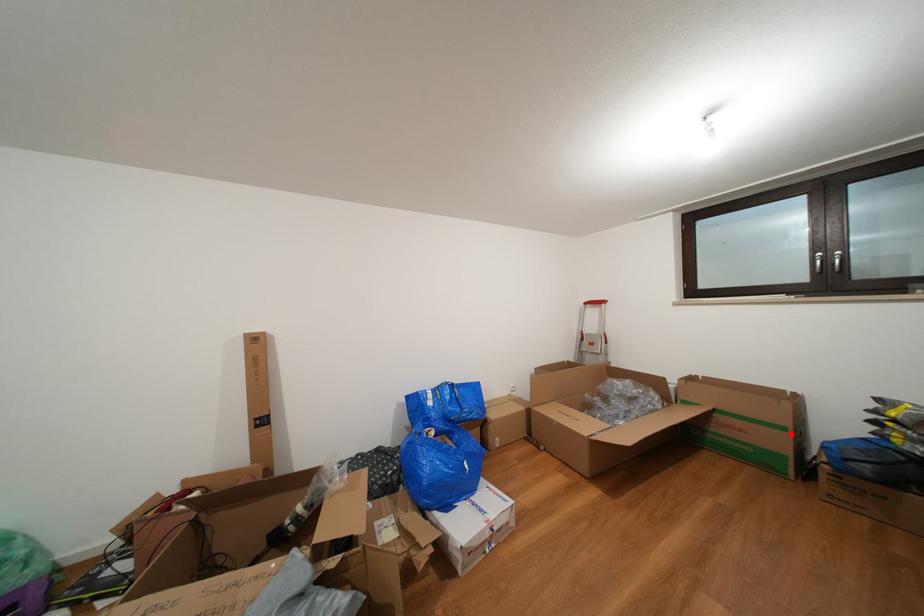
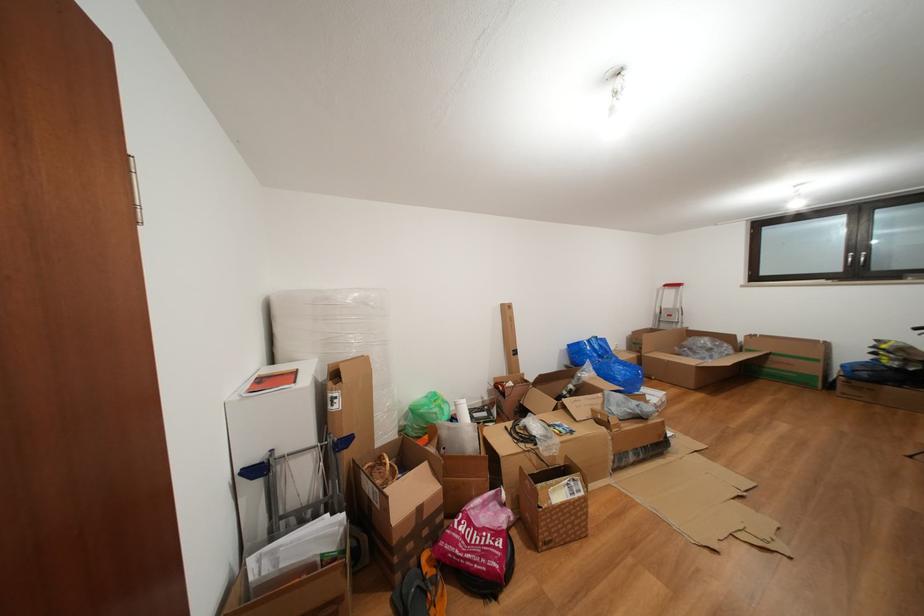
Question: I am providing you with two images of the same scene from different viewpoints. A red point is marked on the first image. At the location where the point appears in image 1, is it still visible in image 2?

Choices:
 (A) Yes
 (B) No

Answer: (A)